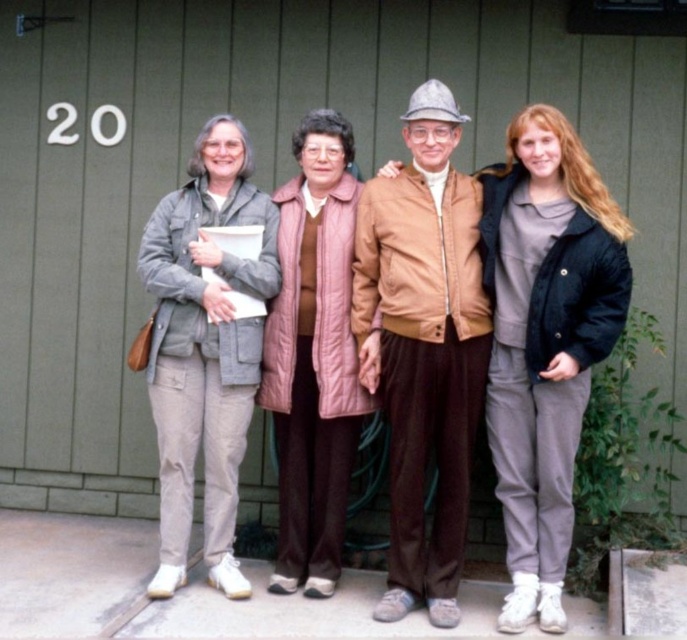
Is tan leather jacket at center wider than light gray fabric pants at left?

No.

Measure the distance between tan leather jacket at center and camera.

A distance of 14.89 feet exists between tan leather jacket at center and camera.

Is point (412, 580) in front of point (225, 221)?

That is True.

Locate an element on the screen. tan leather jacket at center is located at coordinates (423, 346).

Between point (177, 268) and point (300, 259), which one is positioned behind?

Point (300, 259)

Which is more to the left, light gray fabric pants at left or pink quilted vest at center?

light gray fabric pants at left

What do you see at coordinates (203, 348) in the screenshot? I see `light gray fabric pants at left` at bounding box center [203, 348].

Where is `light gray fabric pants at left`? Image resolution: width=687 pixels, height=640 pixels. light gray fabric pants at left is located at coordinates (203, 348).

Is point (385, 228) positioned behind point (405, 380)?

Yes.

What do you see at coordinates (543, 340) in the screenshot? The height and width of the screenshot is (640, 687). I see `matte gray jacket at center` at bounding box center [543, 340].

Is point (550, 150) closer to camera compared to point (412, 144)?

Yes.

Locate an element on the screen. This screenshot has width=687, height=640. matte gray jacket at center is located at coordinates (543, 340).